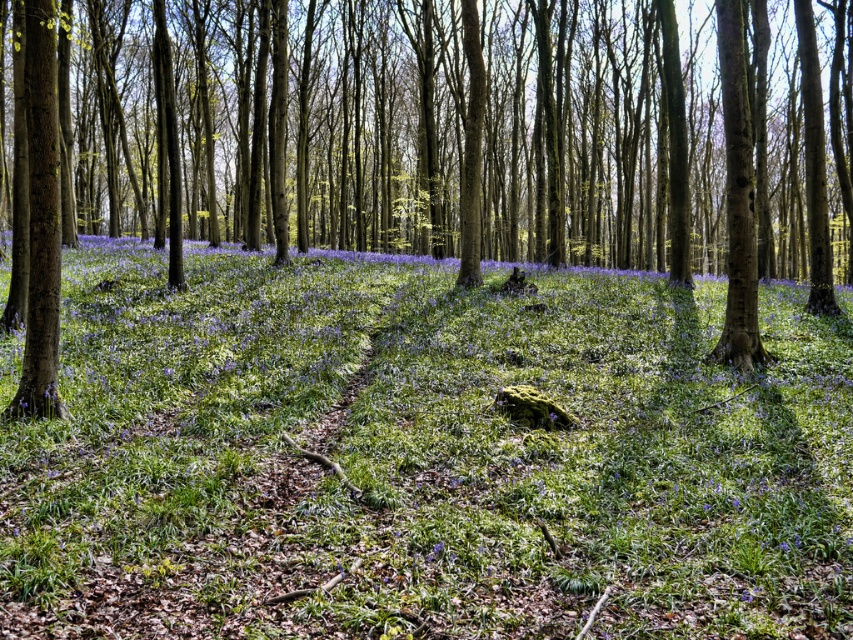
You are a hiker trying to navigate through the forest. You see the green matte grass at center and the brown smooth tree trunk at center. Which one is closer to you in size?

The green matte grass at center is smaller than the brown smooth tree trunk at center, so the grass is closer to you in size.

You are standing in the forest and want to reach the point marked as point (283, 333). If your walking speed is 1.2 meters per second, how long will it take you to reach that point?

The point (283, 333) is 13.54 meters away from the viewer. At a walking speed of 1.2 meters per second, it would take approximately 11.28 seconds to reach it.

You are a hiker who wants to walk through the forest path. You notice the green matte grass at center and the brown smooth tree trunk at center. Which object is taller?

The brown smooth tree trunk at center is taller than the green matte grass at center.